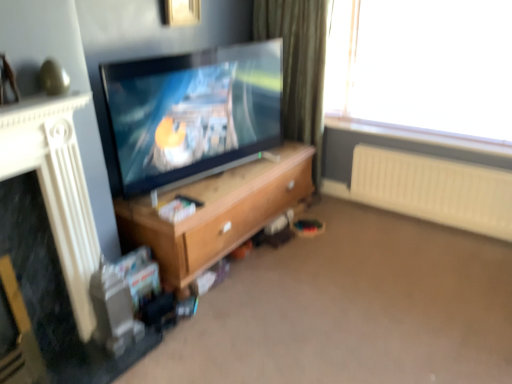
Question: Does white plastic radiator at right have a larger size compared to metallic gold picture frame at upper center?

Choices:
 (A) no
 (B) yes

Answer: (B)

Question: Is white plastic radiator at right not close to metallic gold picture frame at upper center?

Choices:
 (A) yes
 (B) no

Answer: (A)

Question: Is white plastic radiator at right aimed at metallic gold picture frame at upper center?

Choices:
 (A) no
 (B) yes

Answer: (A)

Question: Is the surface of white plastic radiator at right in direct contact with metallic gold picture frame at upper center?

Choices:
 (A) yes
 (B) no

Answer: (B)

Question: Is white plastic radiator at right facing away from metallic gold picture frame at upper center?

Choices:
 (A) yes
 (B) no

Answer: (B)

Question: From a real-world perspective, relative to white textured fireplace at left, is metallic gold picture frame at upper center vertically above or below?

Choices:
 (A) above
 (B) below

Answer: (A)

Question: From the image's perspective, is metallic gold picture frame at upper center positioned above or below white textured fireplace at left?

Choices:
 (A) below
 (B) above

Answer: (B)

Question: Is metallic gold picture frame at upper center taller or shorter than white textured fireplace at left?

Choices:
 (A) tall
 (B) short

Answer: (B)

Question: Considering the positions of metallic gold picture frame at upper center and white textured fireplace at left in the image, is metallic gold picture frame at upper center wider or thinner than white textured fireplace at left?

Choices:
 (A) wide
 (B) thin

Answer: (B)

Question: Would you say metallic gold picture frame at upper center is to the left or to the right of green fabric curtain at upper right in the picture?

Choices:
 (A) left
 (B) right

Answer: (A)

Question: From the image's perspective, relative to green fabric curtain at upper right, is metallic gold picture frame at upper center above or below?

Choices:
 (A) below
 (B) above

Answer: (B)

Question: In the image, is metallic gold picture frame at upper center positioned in front of or behind green fabric curtain at upper right?

Choices:
 (A) behind
 (B) front

Answer: (B)

Question: Based on their sizes in the image, would you say metallic gold picture frame at upper center is bigger or smaller than green fabric curtain at upper right?

Choices:
 (A) big
 (B) small

Answer: (B)

Question: Is green fabric curtain at upper right taller or shorter than matte black tv at center?

Choices:
 (A) tall
 (B) short

Answer: (A)

Question: From the image's perspective, is green fabric curtain at upper right above or below matte black tv at center?

Choices:
 (A) below
 (B) above

Answer: (B)